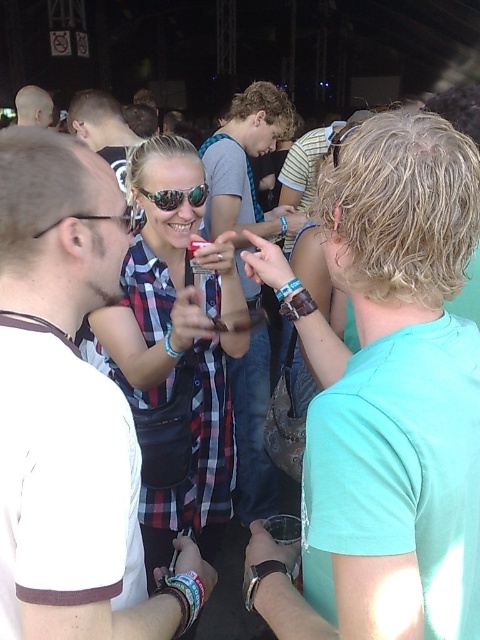
Is denim jeans at center to the left of matte black hair at upper left from the viewer's perspective?

Incorrect, denim jeans at center is not on the left side of matte black hair at upper left.

Can you confirm if denim jeans at center is positioned above matte black hair at upper left?

No, denim jeans at center is not above matte black hair at upper left.

You are a GUI agent. You are given a task and a screenshot of the screen. Output one action in this format:
    pyautogui.click(x=<x>, y=<y>)
    Task: Click on the denim jeans at center
    
    Given the screenshot: What is the action you would take?
    pyautogui.click(x=247, y=173)

Locate an element on the screen. The height and width of the screenshot is (640, 480). denim jeans at center is located at coordinates point(247,173).

Measure the distance between plaid shirt at center and shiny reflective sunglasses at center.

plaid shirt at center and shiny reflective sunglasses at center are 15.74 inches apart from each other.

Is point (154, 282) positioned before point (172, 204)?

No, (154, 282) is behind (172, 204).

Identify the location of plaid shirt at center. The width and height of the screenshot is (480, 640). (178, 346).

Between point (129, 147) and point (34, 237), which one is positioned behind?

Point (129, 147)

This screenshot has height=640, width=480. I want to click on matte black hair at upper left, so click(x=103, y=129).

Is point (123, 129) positioned before point (127, 216)?

No, it is behind (127, 216).

The width and height of the screenshot is (480, 640). What are the coordinates of `matte black hair at upper left` in the screenshot? It's located at (103, 129).